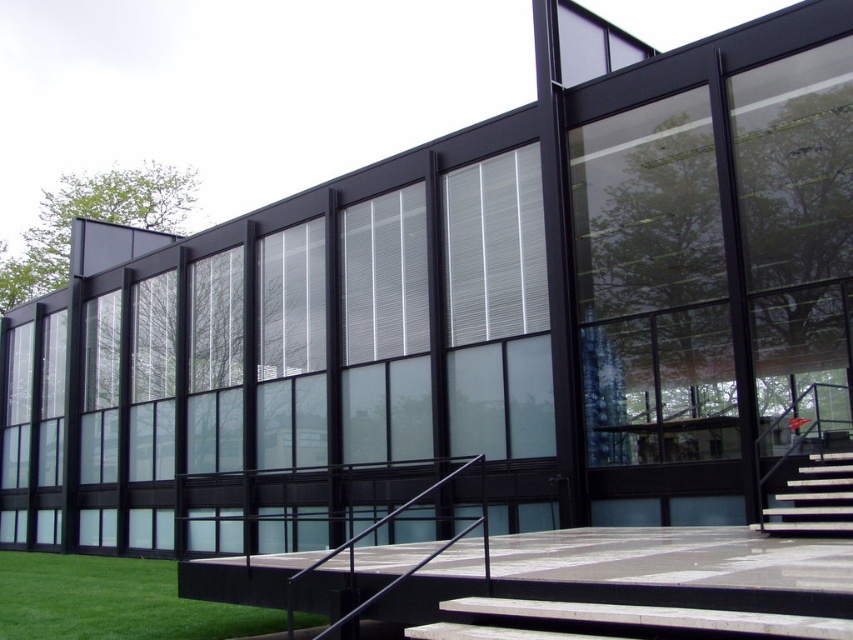
Consider the image. Can you confirm if green grass at lower left is thinner than white glossy stair at lower right?

Incorrect, green grass at lower left's width is not less than white glossy stair at lower right's.

Is point (57, 620) behind point (787, 481)?

No, it is in front of (787, 481).

Where is `green grass at lower left`? The width and height of the screenshot is (853, 640). green grass at lower left is located at coordinates (112, 602).

Is white glossy stair at lower right closer to the viewer compared to black metal/rail at center?

No, it is not.

Which of these two, white glossy stair at lower right or black metal/rail at center, stands taller?

black metal/rail at center

Locate an element on the screen. Image resolution: width=853 pixels, height=640 pixels. white glossy stair at lower right is located at coordinates (811, 499).

Can you confirm if green grass at lower left is positioned to the right of black metal/rail at center?

Incorrect, green grass at lower left is not on the right side of black metal/rail at center.

Is green grass at lower left closer to camera compared to black metal/rail at center?

No, green grass at lower left is further to the viewer.

What do you see at coordinates (112, 602) in the screenshot? I see `green grass at lower left` at bounding box center [112, 602].

The image size is (853, 640). I want to click on green grass at lower left, so click(112, 602).